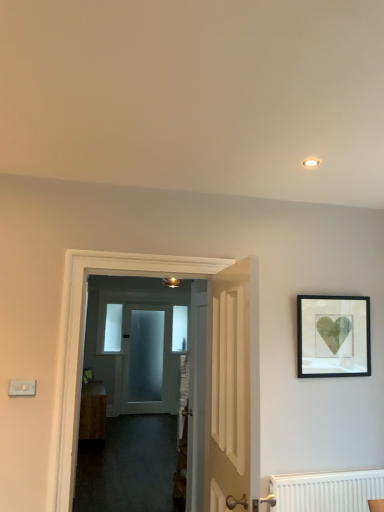
Question: Considering the positions of black matte picture frame at upper right and wooden cabinet at center in the image, is black matte picture frame at upper right taller or shorter than wooden cabinet at center?

Choices:
 (A) short
 (B) tall

Answer: (A)

Question: In terms of size, does black matte picture frame at upper right appear bigger or smaller than wooden cabinet at center?

Choices:
 (A) big
 (B) small

Answer: (B)

Question: Which is farther from the white wooden door at center, which is the 3th door from back to front?

Choices:
 (A) clear glass door at center, the first window from the front
 (B) black matte picture frame at upper right
 (C) frosted glass door at center, the 1th door when ordered from back to front
 (D) clear glass window at center, marked as the 2th window in a left-to-right arrangement
 (E) white plastic light switch at lower left

Answer: (A)

Question: Which object is positioned closest to the frosted glass door at center, placed as the 3th door when sorted from front to back?

Choices:
 (A) black matte picture frame at upper right
 (B) white plastic light switch at lower left
 (C) white wooden door at center, which is the 3th door from back to front
 (D) clear glass door at center, which ranks as the first window in left-to-right order
 (E) white wooden door at center, which is counted as the second door, starting from the back

Answer: (D)